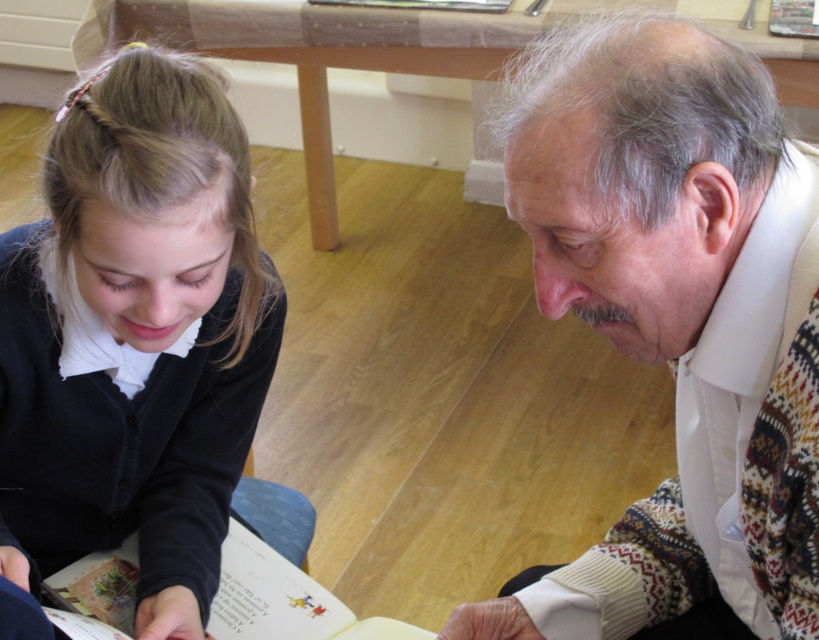
You are a photographer taking a picture of the scene. You need to ensure that both the white textured sweater at center and the paper book at lower left are clearly visible in the frame. Based on their positions, which object should you focus on first to ensure both are in focus?

The white textured sweater at center is located above the paper book at lower left. To ensure both are in focus, you should focus on the white textured sweater at center first since it is closer to the camera, and the paper book at lower left will naturally fall into the depth of field below it.